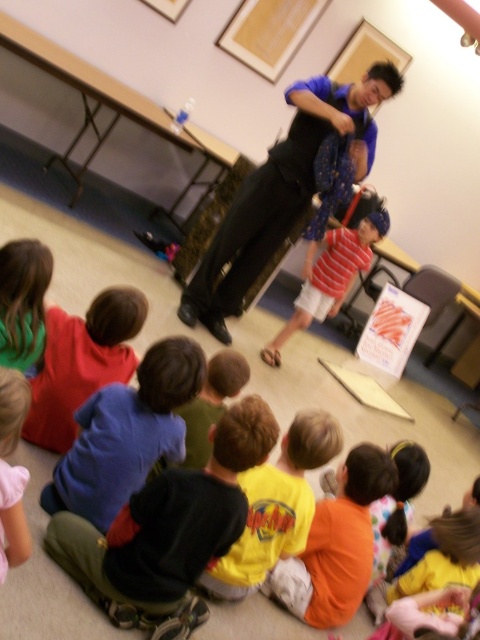
Question: In this image, where is yellow t-shirt at lower center located relative to striped cotton shirt at center?

Choices:
 (A) left
 (B) right

Answer: (A)

Question: Which point is closer to the camera?

Choices:
 (A) (327, 284)
 (B) (120, 392)
 (C) (284, 436)
 (D) (327, 573)

Answer: (B)

Question: Which of these objects is positioned farthest from the dark blue shirt at center?

Choices:
 (A) green hair at lower left
 (B) soft pink shirt at lower left

Answer: (A)

Question: Which point appears closest to the camera in this image?

Choices:
 (A) [x=298, y=552]
 (B) [x=249, y=234]

Answer: (A)

Question: Can you confirm if dark blue shirt at center is positioned above soft pink shirt at lower left?

Choices:
 (A) no
 (B) yes

Answer: (A)

Question: Is yellow t-shirt at lower center behind green hair at lower left?

Choices:
 (A) no
 (B) yes

Answer: (B)